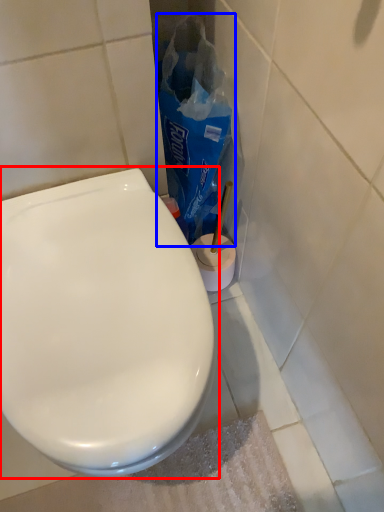
Question: Among these objects, which one is farthest to the camera, toilet (highlighted by a red box) or paper bag (highlighted by a blue box)?

Choices:
 (A) toilet
 (B) paper bag

Answer: (B)